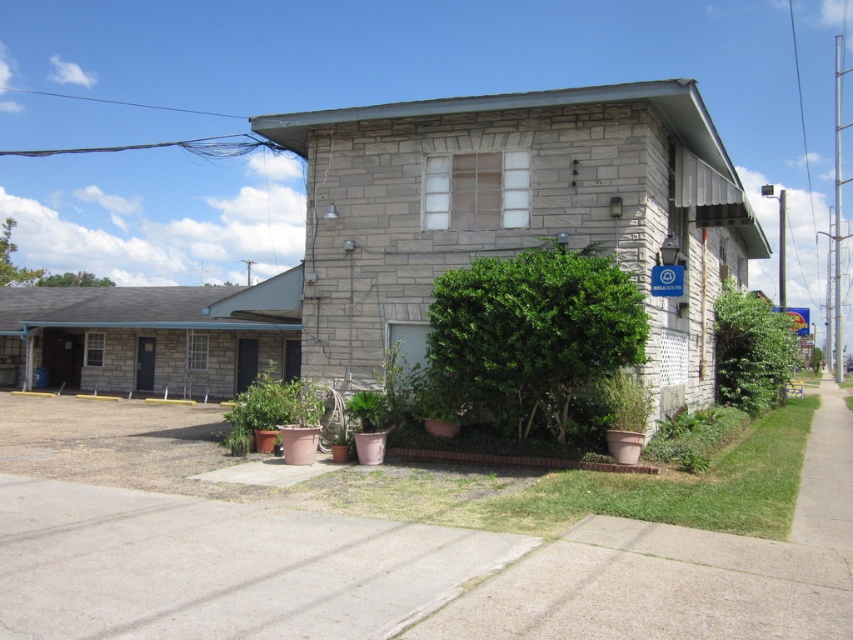
Question: From the image, what is the correct spatial relationship of green leafy bush at right in relation to matte terracotta pot at center?

Choices:
 (A) above
 (B) below

Answer: (A)

Question: Among these objects, which one is nearest to the camera?

Choices:
 (A) green matte plant at lower center
 (B) green leafy bush at right
 (C) green matte planter at lower right
 (D) matte terracotta pot at center

Answer: (C)

Question: Can you confirm if matte terracotta pot at center is positioned below green matte plant at lower center?

Choices:
 (A) yes
 (B) no

Answer: (A)

Question: Is green leafy bush at right smaller than matte terracotta pot at center?

Choices:
 (A) no
 (B) yes

Answer: (B)

Question: Which object is positioned closest to the green matte planter at lower right?

Choices:
 (A) green leafy bush at right
 (B) green matte plant at lower center

Answer: (B)

Question: Which object is the closest to the matte terracotta pot at center?

Choices:
 (A) green matte plant at lower center
 (B) green leafy bush at right
 (C) green matte planter at lower right

Answer: (A)